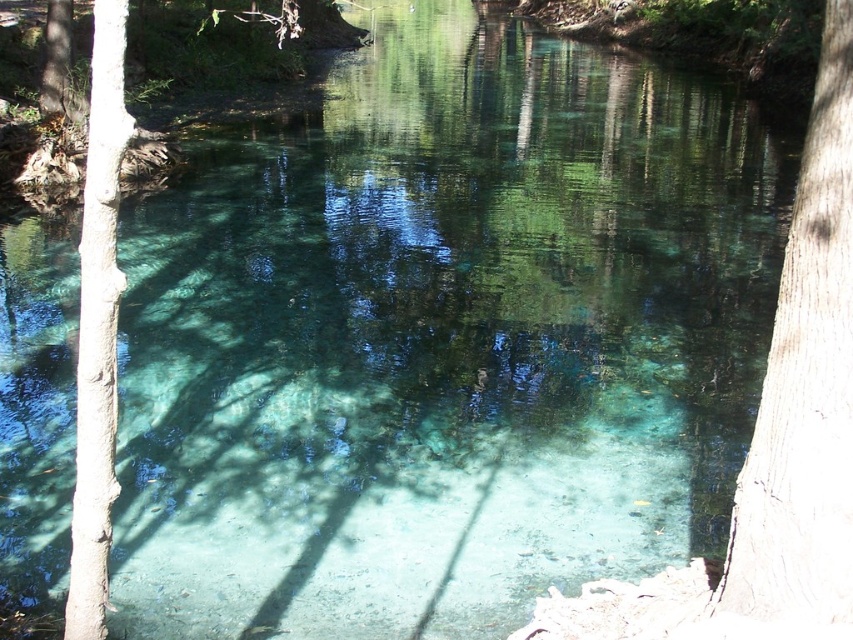
Question: Among these points, which one is farthest from the camera?

Choices:
 (A) (770, 456)
 (B) (96, 54)

Answer: (A)

Question: Among these points, which one is farthest from the camera?

Choices:
 (A) (799, 465)
 (B) (105, 180)

Answer: (A)

Question: Can you confirm if smooth brown tree trunk at right is smaller than smooth bark tree at left?

Choices:
 (A) yes
 (B) no

Answer: (B)

Question: Can you confirm if smooth brown tree trunk at right is smaller than smooth bark tree at left?

Choices:
 (A) no
 (B) yes

Answer: (A)

Question: Can you confirm if smooth brown tree trunk at right is positioned to the right of smooth bark tree at left?

Choices:
 (A) no
 (B) yes

Answer: (B)